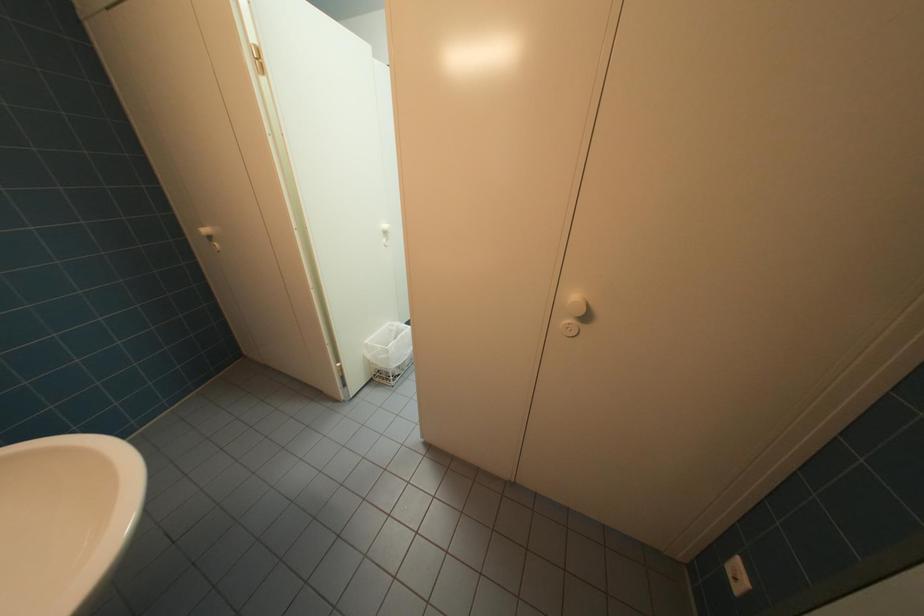
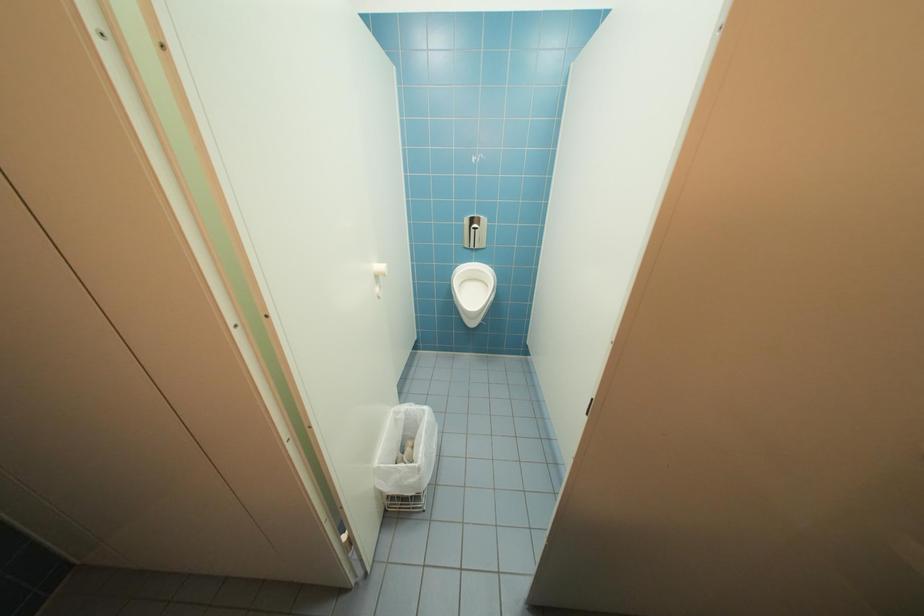
Question: The camera is either moving clockwise (left) or counter-clockwise (right) around the object. The first image is from the beginning of the video and the second image is from the end. Is the camera moving left or right when shooting the video?

Choices:
 (A) Left
 (B) Right

Answer: (A)